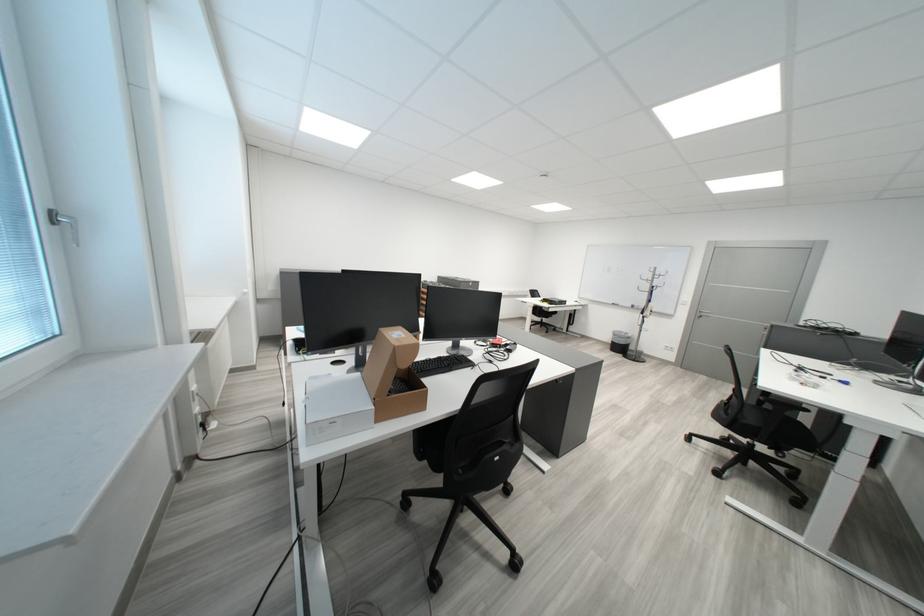
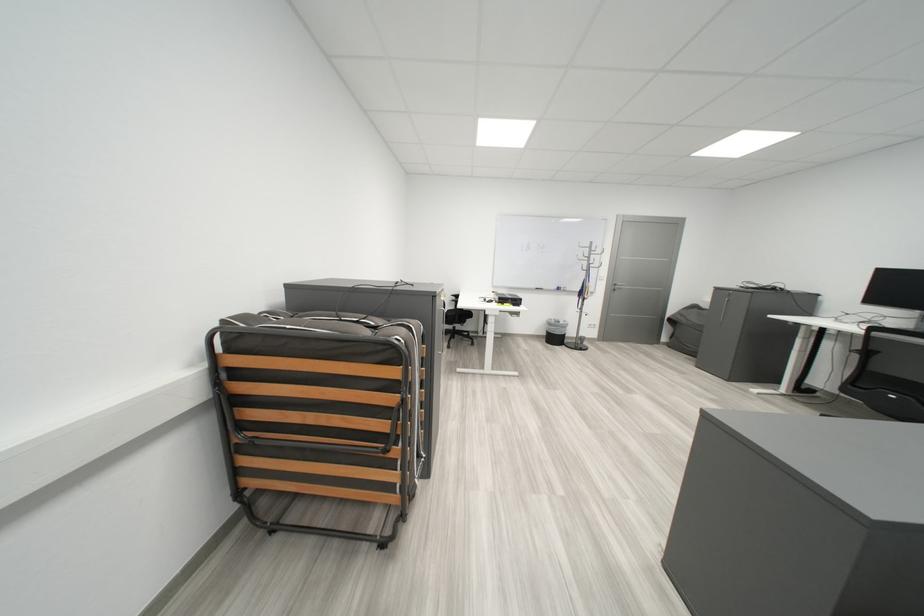
Find the pixel in the second image that matches the point at 627,336 in the first image.

(563, 326)